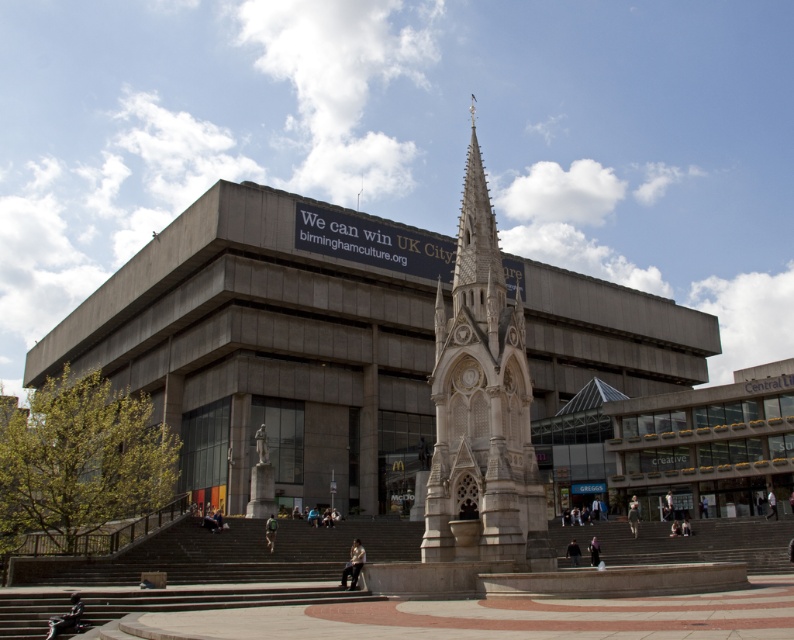
Question: Which point appears closest to the camera in this image?

Choices:
 (A) (634, 516)
 (B) (775, 506)

Answer: (B)

Question: Among these points, which one is nearest to the camera?

Choices:
 (A) (70, 627)
 (B) (771, 499)
 (C) (596, 552)

Answer: (A)

Question: Is dark gray jacket at lower left above dark gray jacket at center?

Choices:
 (A) no
 (B) yes

Answer: (B)

Question: Is concrete stairs at center closer to camera compared to camouflage fabric backpack at lower center?

Choices:
 (A) yes
 (B) no

Answer: (A)

Question: Can you confirm if white stone monument at center is bigger than dark blue fabric at lower center?

Choices:
 (A) no
 (B) yes

Answer: (B)

Question: Estimate the real-world distances between objects in this image. Which object is closer to the camouflage fabric backpack at lower center?

Choices:
 (A) concrete stairs at center
 (B) dark blue fabric at lower center
 (C) light brown leather jacket at center

Answer: (C)